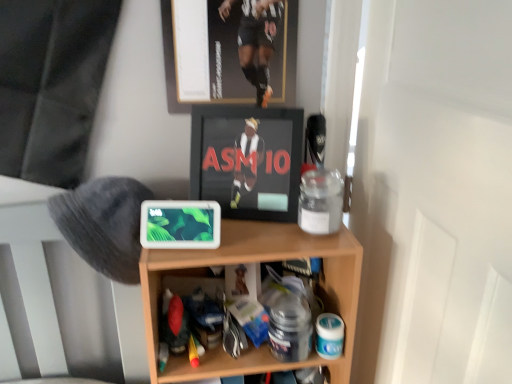
Question: Does wooden shelf at center have a lesser height compared to black glossy frame at center?

Choices:
 (A) yes
 (B) no

Answer: (B)

Question: Is wooden shelf at center looking in the opposite direction of black glossy frame at center?

Choices:
 (A) yes
 (B) no

Answer: (B)

Question: Considering the relative sizes of wooden shelf at center and black glossy frame at center in the image provided, is wooden shelf at center bigger than black glossy frame at center?

Choices:
 (A) yes
 (B) no

Answer: (A)

Question: Could you tell me if wooden shelf at center is facing black glossy frame at center?

Choices:
 (A) yes
 (B) no

Answer: (B)

Question: Is wooden shelf at center not within black glossy frame at center?

Choices:
 (A) no
 (B) yes

Answer: (B)

Question: Considering their positions, is black glossy frame at center located in front of or behind gray fuzzy hat at left?

Choices:
 (A) behind
 (B) front

Answer: (A)

Question: Is black glossy frame at center to the left or to the right of gray fuzzy hat at left in the image?

Choices:
 (A) left
 (B) right

Answer: (B)

Question: From a real-world perspective, is black glossy frame at center physically located above or below gray fuzzy hat at left?

Choices:
 (A) above
 (B) below

Answer: (A)

Question: Is black glossy frame at center taller or shorter than gray fuzzy hat at left?

Choices:
 (A) short
 (B) tall

Answer: (A)

Question: From a real-world perspective, is gray fuzzy hat at left positioned above or below metallic gold picture frame at upper center?

Choices:
 (A) below
 (B) above

Answer: (A)

Question: Looking at the image, does gray fuzzy hat at left seem bigger or smaller compared to metallic gold picture frame at upper center?

Choices:
 (A) small
 (B) big

Answer: (B)

Question: From the image's perspective, is gray fuzzy hat at left positioned above or below metallic gold picture frame at upper center?

Choices:
 (A) below
 (B) above

Answer: (A)

Question: In the image, is gray fuzzy hat at left positioned in front of or behind metallic gold picture frame at upper center?

Choices:
 (A) front
 (B) behind

Answer: (A)

Question: Based on their positions, is wooden shelf at center located to the left or right of gray fuzzy hat at left?

Choices:
 (A) left
 (B) right

Answer: (B)

Question: Is wooden shelf at center situated inside gray fuzzy hat at left or outside?

Choices:
 (A) inside
 (B) outside

Answer: (B)